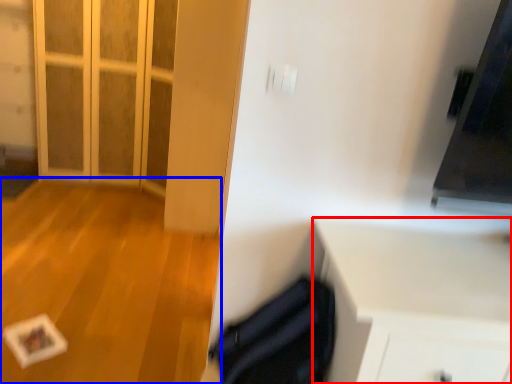
Question: Which point is further to the camera, cabinetry (highlighted by a red box) or plain (highlighted by a blue box)?

Choices:
 (A) cabinetry
 (B) plain

Answer: (B)